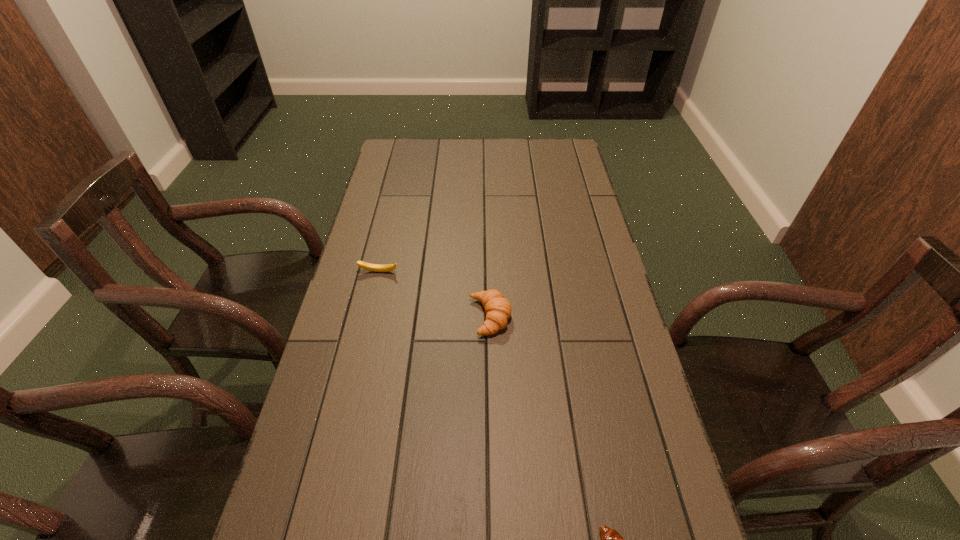
Where is `free spot at the far left corner of the desktop`? This screenshot has height=540, width=960. free spot at the far left corner of the desktop is located at coordinates (408, 151).

You are a GUI agent. You are given a task and a screenshot of the screen. Output one action in this format:
    pyautogui.click(x=<x>, y=<y>)
    Task: Click on the free space that is in between the farther crescent roll and the leftmost object
    This screenshot has height=540, width=960.
    Given the screenshot: What is the action you would take?
    (x=434, y=294)

Identify the location of free point between the banana and the left crescent roll. (434, 294).

Identify the location of the second closest object to the second object from right to left. This screenshot has height=540, width=960. (610, 539).

Locate an element on the screen. object that stands as the second closest to the shorter crescent roll is located at coordinates (368, 266).

At what (x,y) coordinates should I click in order to perform the action: click on vacant space that satisfies the following two spatial constraints: 1. at the stem of the farthest object; 2. on the right side of the tallest object. Please return your answer as a coordinate pair (x, y). This screenshot has width=960, height=540. Looking at the image, I should click on (369, 317).

Identify the location of free space that satisfies the following two spatial constraints: 1. at the stem of the farthest object; 2. on the left side of the second object from right to left. (369, 317).